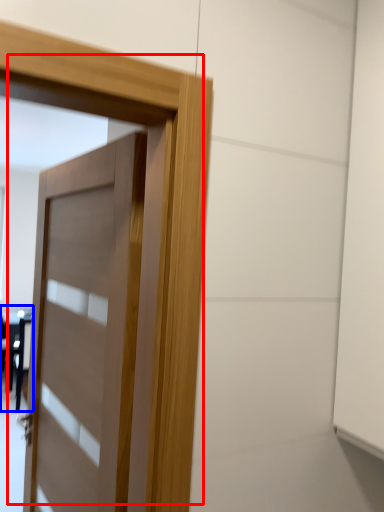
Question: Among these objects, which one is farthest to the camera, door (highlighted by a red box) or table (highlighted by a blue box)?

Choices:
 (A) door
 (B) table

Answer: (B)